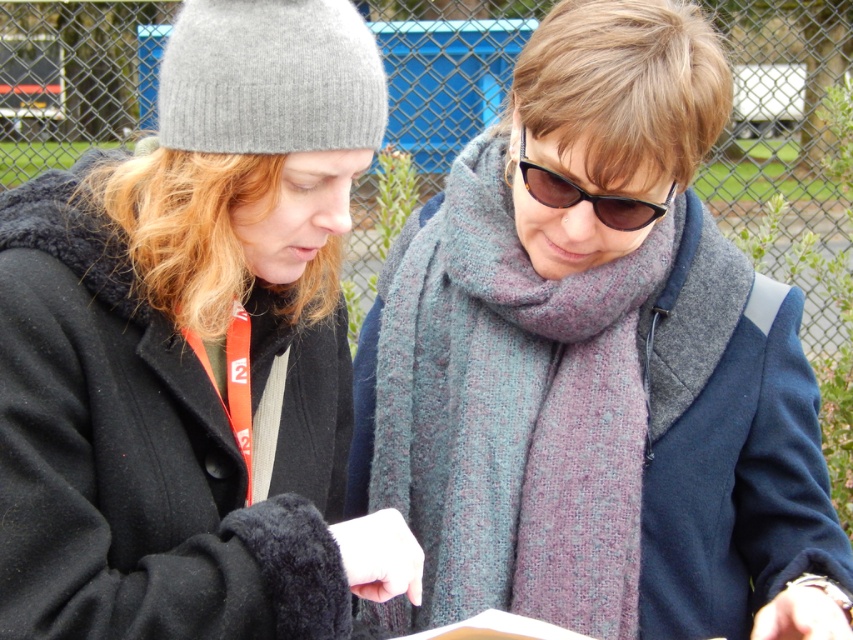
Can you confirm if matte black coat at left is wider than knitted wool scarf at center?

No.

At what (x,y) coordinates should I click in order to perform the action: click on matte black coat at left. Please return your answer as a coordinate pair (x, y). Looking at the image, I should click on (195, 349).

Image resolution: width=853 pixels, height=640 pixels. I want to click on matte black coat at left, so click(195, 349).

Which is behind, point (422, 483) or point (640, 227)?

Positioned behind is point (422, 483).

Between knitted wool scarf at center and havana tortoiseshell sunglasses at center, which one is positioned lower?

knitted wool scarf at center is lower down.

I want to click on knitted wool scarf at center, so click(505, 413).

Locate an element on the screen. The height and width of the screenshot is (640, 853). knitted wool scarf at center is located at coordinates (505, 413).

Is matte black coat at left smaller than havana tortoiseshell sunglasses at center?

Incorrect, matte black coat at left is not smaller in size than havana tortoiseshell sunglasses at center.

Which is behind, point (38, 184) or point (596, 216)?

The point (596, 216) is behind.

You are a GUI agent. You are given a task and a screenshot of the screen. Output one action in this format:
    pyautogui.click(x=<x>, y=<y>)
    Task: Click on the matte black coat at left
    
    Given the screenshot: What is the action you would take?
    pyautogui.click(x=195, y=349)